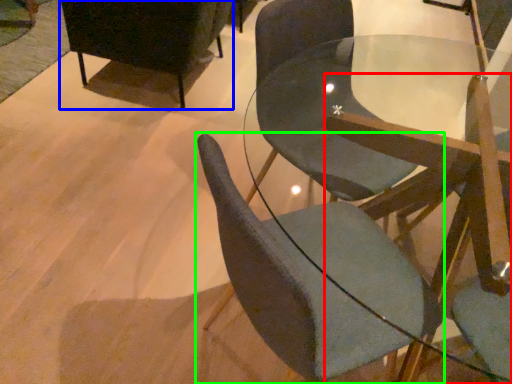
Question: Which object is positioned farthest from chair (highlighted by a red box)? Select from chair (highlighted by a blue box) and chair (highlighted by a green box).

Choices:
 (A) chair
 (B) chair

Answer: (A)